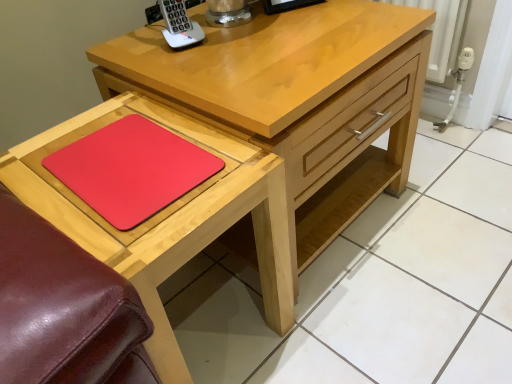
Locate an element on the screen. free space to the right of white plastic phone at upper center is located at coordinates (252, 40).